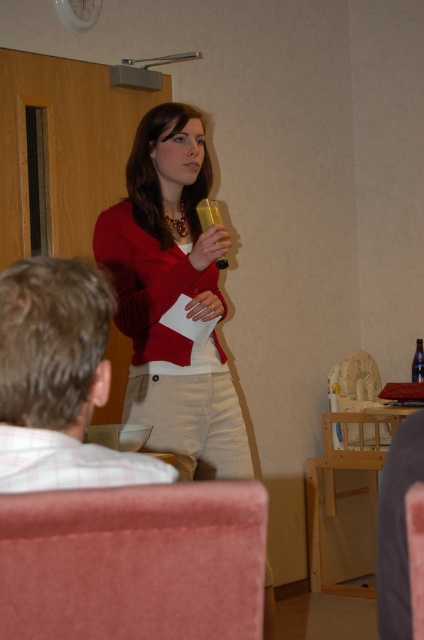
You are a guest at an event and need to place your translucent plastic cup at center on a nearby seat. Can you put it on the pink fabric armchair at lower left without moving the cup?

The pink fabric armchair at lower left is below the translucent plastic cup at center, so the cup is already positioned above the armchair. Therefore, you can place the translucent plastic cup at center on the pink fabric armchair at lower left without moving the cup.

You are organizing a small event and need to place both the matte red sweater at center and the translucent plastic bottle at center on a shelf. The shelf has limited space, and you want to ensure the larger item is placed first. Which object should you place first?

The matte red sweater at center is larger in size than the translucent plastic bottle at center, so you should place the matte red sweater at center first to accommodate its size on the shelf.